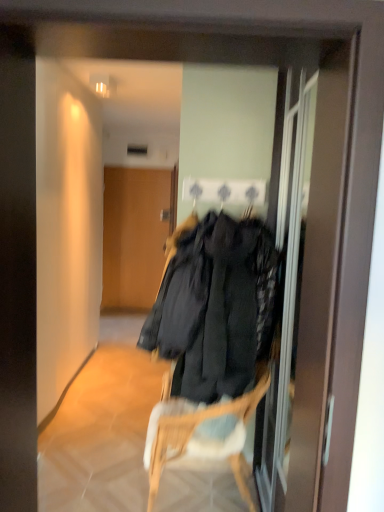
This screenshot has width=384, height=512. Describe the element at coordinates (134, 236) in the screenshot. I see `wooden door at center` at that location.

You are a GUI agent. You are given a task and a screenshot of the screen. Output one action in this format:
    pyautogui.click(x=<x>, y=<y>)
    Task: Click on the woven wood chair at center
    
    Given the screenshot: What is the action you would take?
    pyautogui.click(x=197, y=426)

Is woven wood chair at center positioned with its back to wooden door at center?

Yes.

From a real-world perspective, is woven wood chair at center physically located above or below wooden door at center?

A: From a real-world perspective, woven wood chair at center is physically below wooden door at center.

Consider the image. Is woven wood chair at center next to wooden door at center and touching it?

woven wood chair at center is not next to wooden door at center, and they're not touching.

Considering the positions of points (287, 110) and (145, 207), is point (287, 110) closer to camera compared to point (145, 207)?

Yes, it is in front of point (145, 207).

Is wooden door at center surrounded by transparent glass screen door at center?

No, wooden door at center is not a part of transparent glass screen door at center.

Is transparent glass screen door at center turned away from wooden door at center?

No, transparent glass screen door at center's orientation is not away from wooden door at center.

Does transparent glass screen door at center appear on the left side of wooden door at center?

No.

Is wooden door at center at the right side of woven wood chair at center?

No, wooden door at center is not to the right of woven wood chair at center.

From the image's perspective, is wooden door at center beneath woven wood chair at center?

No, from the image's perspective, wooden door at center is not below woven wood chair at center.

Is wooden door at center in front of or behind woven wood chair at center in the image?

In the image, wooden door at center appears behind woven wood chair at center.

Is wooden door at center touching woven wood chair at center?

No, wooden door at center is not beside woven wood chair at center.

In the image, is transparent glass screen door at center on the left side or the right side of woven wood chair at center?

Clearly, transparent glass screen door at center is on the right of woven wood chair at center in the image.

Is transparent glass screen door at center facing towards woven wood chair at center?

Yes, transparent glass screen door at center faces towards woven wood chair at center.

Is the depth of transparent glass screen door at center less than that of woven wood chair at center?

Yes, it is.

Which object is positioned more to the left, woven wood chair at center or transparent glass screen door at center?

woven wood chair at center.

Locate an element on the screen. screen door located in front of the woven wood chair at center is located at coordinates (305, 276).

Which of these two, woven wood chair at center or transparent glass screen door at center, stands taller?

transparent glass screen door at center.

Considering the positions of point (260, 399) and point (323, 66), is point (260, 399) closer or farther from the camera than point (323, 66)?

Point (260, 399) is positioned farther from the camera compared to point (323, 66).

Is wooden door at center aimed at transparent glass screen door at center?

Yes, wooden door at center is facing transparent glass screen door at center.

Between wooden door at center and transparent glass screen door at center, which one is positioned behind?

wooden door at center is behind.

Between point (116, 289) and point (332, 293), which one is positioned behind?

Point (116, 289)

Where is `door above the woven wood chair at center (from a real-world perspective)`? This screenshot has width=384, height=512. door above the woven wood chair at center (from a real-world perspective) is located at coordinates (134, 236).

This screenshot has height=512, width=384. Find the location of `door that is under the transparent glass screen door at center (from a real-world perspective)`. door that is under the transparent glass screen door at center (from a real-world perspective) is located at coordinates (134, 236).

Which object lies further to the anchor point transparent glass screen door at center, wooden door at center or woven wood chair at center?

wooden door at center is further to transparent glass screen door at center.

Estimate the real-world distances between objects in this image. Which object is closer to wooden door at center, woven wood chair at center or transparent glass screen door at center?

transparent glass screen door at center is closer to wooden door at center.

When comparing their distances from transparent glass screen door at center, does woven wood chair at center or wooden door at center seem closer?

Based on the image, woven wood chair at center appears to be nearer to transparent glass screen door at center.

From the image, which object appears to be farther from woven wood chair at center, transparent glass screen door at center or wooden door at center?

Among the two, wooden door at center is located further to woven wood chair at center.

When comparing their distances from wooden door at center, does transparent glass screen door at center or woven wood chair at center seem further?

Based on the image, woven wood chair at center appears to be further to wooden door at center.

Which object lies nearer to the anchor point woven wood chair at center, wooden door at center or transparent glass screen door at center?

Among the two, transparent glass screen door at center is located nearer to woven wood chair at center.

Locate an element on the screen. The width and height of the screenshot is (384, 512). chair between transparent glass screen door at center and wooden door at center in the front-back direction is located at coordinates (197, 426).